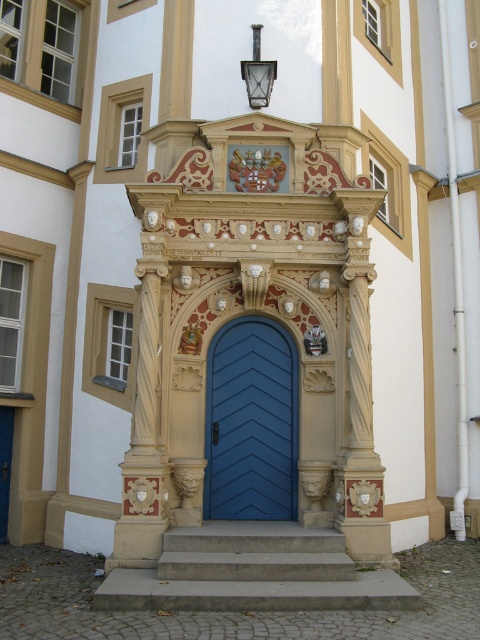
The height and width of the screenshot is (640, 480). Describe the element at coordinates (253, 572) in the screenshot. I see `concrete steps at center` at that location.

Is point (214, 605) behind point (225, 396)?

No, (214, 605) is in front of (225, 396).

In order to click on concrete steps at center in this screenshot , I will do `click(253, 572)`.